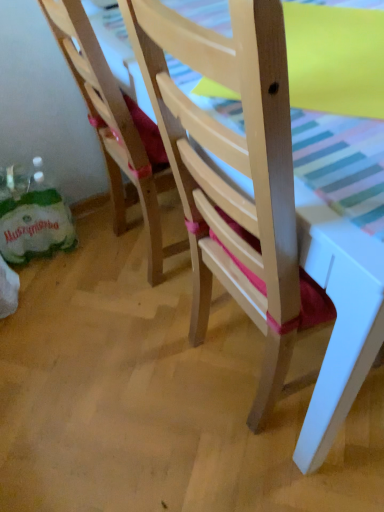
Question: Is wooden chair at lower left, the second chair when ordered from right to left, outside of matte yellow table at upper right?

Choices:
 (A) no
 (B) yes

Answer: (B)

Question: Is wooden chair at lower left, the second chair when ordered from right to left, next to matte yellow table at upper right?

Choices:
 (A) yes
 (B) no

Answer: (B)

Question: Is wooden chair at lower left, arranged as the first chair when viewed from the left, at the right side of matte yellow table at upper right?

Choices:
 (A) no
 (B) yes

Answer: (A)

Question: Is matte yellow table at upper right located within wooden chair at lower left, arranged as the first chair when viewed from the left?

Choices:
 (A) yes
 (B) no

Answer: (B)

Question: From a real-world perspective, is wooden chair at lower left, the second chair when ordered from right to left, over matte yellow table at upper right?

Choices:
 (A) yes
 (B) no

Answer: (B)

Question: Does wooden chair at lower left, the second chair when ordered from right to left, have a smaller size compared to matte yellow table at upper right?

Choices:
 (A) yes
 (B) no

Answer: (B)

Question: Is wooden chair at lower left, the second chair when ordered from right to left, at the left side of wooden chair at center, which is the first chair from right to left?

Choices:
 (A) no
 (B) yes

Answer: (B)

Question: Can you confirm if wooden chair at lower left, arranged as the first chair when viewed from the left, is wider than wooden chair at center, which is the first chair from right to left?

Choices:
 (A) no
 (B) yes

Answer: (A)

Question: From a real-world perspective, is wooden chair at lower left, arranged as the first chair when viewed from the left, physically above wooden chair at center, which is the first chair from right to left?

Choices:
 (A) no
 (B) yes

Answer: (A)

Question: Is wooden chair at lower left, the second chair when ordered from right to left, next to wooden chair at center, which is the first chair from right to left, and touching it?

Choices:
 (A) yes
 (B) no

Answer: (B)

Question: Would you say wooden chair at lower left, the second chair when ordered from right to left, is a long distance from wooden chair at center, marked as the second chair in a left-to-right arrangement?

Choices:
 (A) no
 (B) yes

Answer: (A)

Question: Can you confirm if wooden chair at lower left, the second chair when ordered from right to left, is smaller than wooden chair at center, marked as the second chair in a left-to-right arrangement?

Choices:
 (A) yes
 (B) no

Answer: (A)

Question: Is matte yellow table at upper right closer to the viewer compared to wooden chair at center, marked as the second chair in a left-to-right arrangement?

Choices:
 (A) no
 (B) yes

Answer: (A)